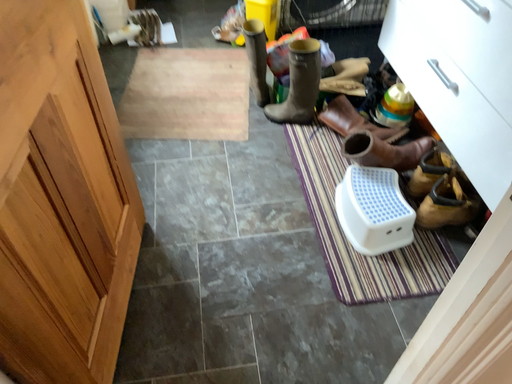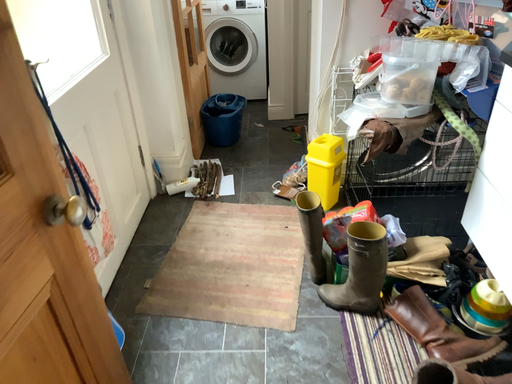
Question: Which way did the camera rotate in the video?

Choices:
 (A) rotated left
 (B) rotated right

Answer: (A)